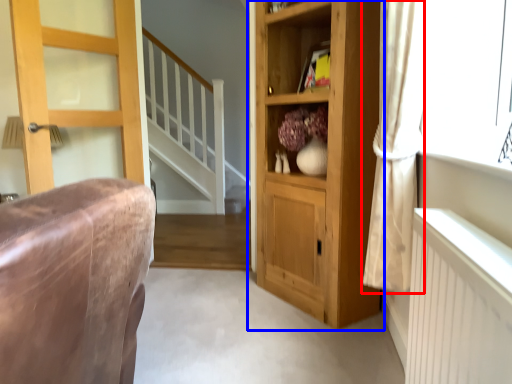
Question: Which object appears closest to the camera in this image, curtain (highlighted by a red box) or cupboard (highlighted by a blue box)?

Choices:
 (A) curtain
 (B) cupboard

Answer: (A)